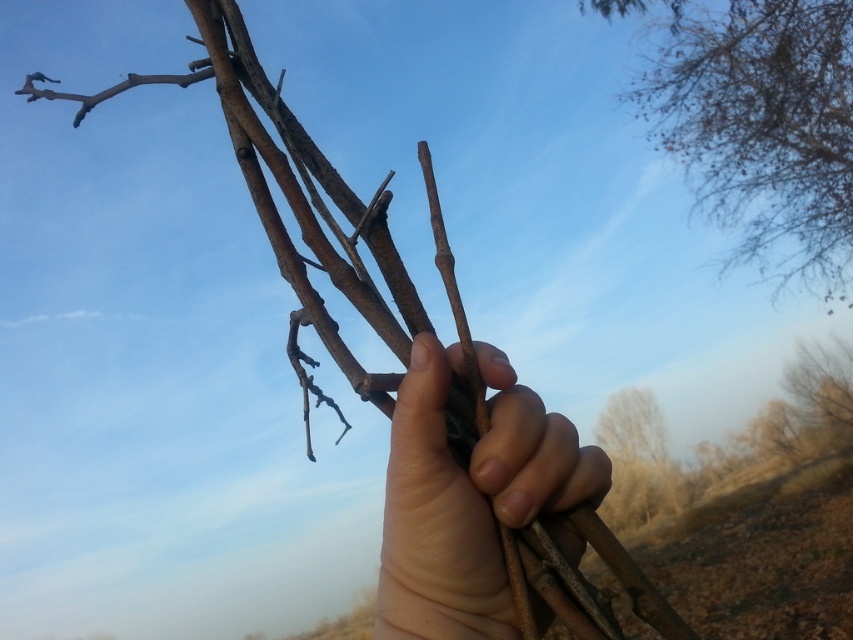
You are an artist sketching the scene and want to add a detail at the position of point (x=759, y=125). What object should you draw there?

You should draw the bare branches at upper right at the position of point (x=759, y=125).

You are a photographer trying to capture the smooth brown hand at center and the brown rough tree at lower right in a single frame. Which object will appear larger in your photo?

The smooth brown hand at center will appear larger in the photo because it is closer to the viewer than the brown rough tree at lower right.

You are an artist sketching the scene and need to determine the relative positions of the smooth brown hand at center and the brown rough tree at lower right. Which object is positioned higher in the image?

The smooth brown hand at center is positioned higher than the brown rough tree at lower right.